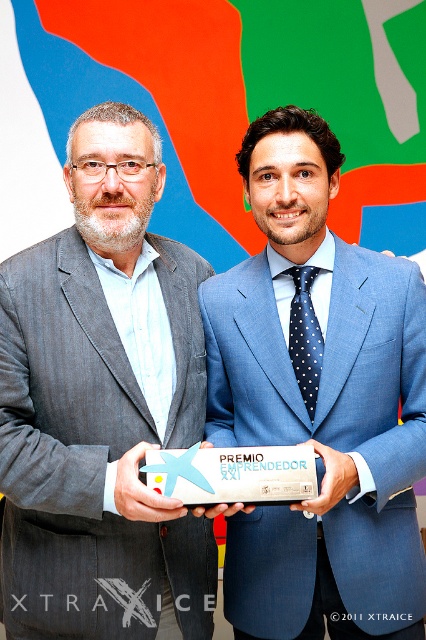
Question: Is blue woolen suit at center positioned behind dark blue dotted tie at center?

Choices:
 (A) yes
 (B) no

Answer: (B)

Question: From the image, what is the correct spatial relationship of gray textured suit at left in relation to dark blue dotted tie at center?

Choices:
 (A) left
 (B) right

Answer: (A)

Question: Which of the following is the farthest from the observer?

Choices:
 (A) (267, 484)
 (B) (65, 547)
 (C) (310, 285)
 (D) (382, 618)

Answer: (C)

Question: Considering the real-world distances, which object is farthest from the dark blue dotted tie at center?

Choices:
 (A) white plastic plaque at center
 (B) gray textured suit at left
 (C) blue woolen suit at center

Answer: (B)

Question: Considering the relative positions of blue woolen suit at center and white plastic plaque at center in the image provided, where is blue woolen suit at center located with respect to white plastic plaque at center?

Choices:
 (A) below
 (B) above

Answer: (B)

Question: Considering the real-world distances, which object is closest to the gray textured suit at left?

Choices:
 (A) white plastic plaque at center
 (B) blue woolen suit at center
 (C) dark blue dotted tie at center

Answer: (B)